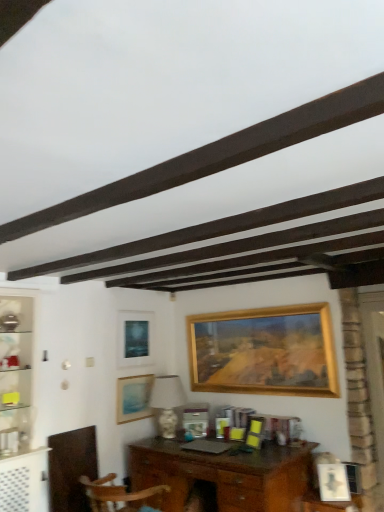
At what (x,y) coordinates should I click in order to perform the action: click on vacant area that lies in front of white glossy lamp at center. Please return your answer as a coordinate pair (x, y). This screenshot has height=512, width=384. Looking at the image, I should click on (165, 445).